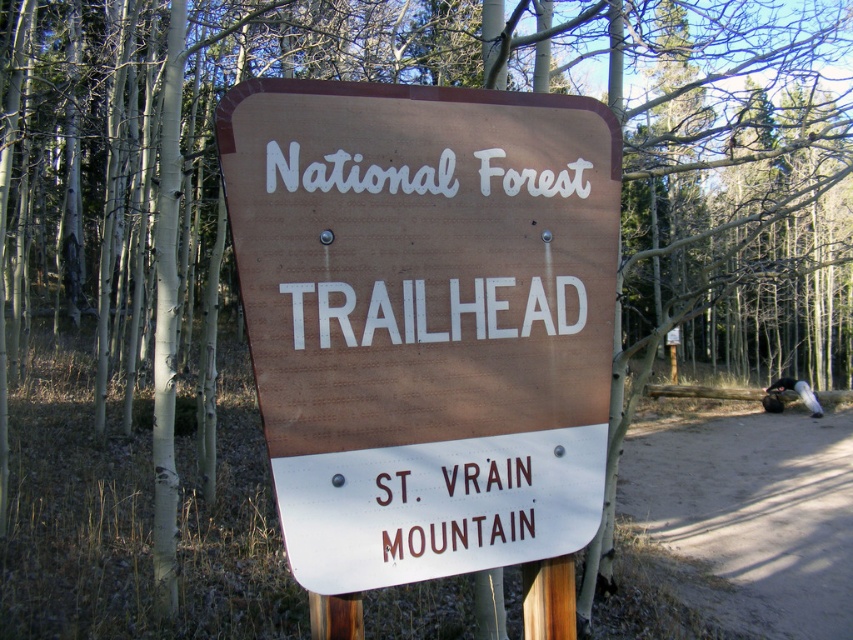
Question: Can you confirm if brown wood trailhead sign at center is bigger than dirt path at lower right?

Choices:
 (A) yes
 (B) no

Answer: (B)

Question: Considering the real-world distances, which object is closest to the dirt path at lower right?

Choices:
 (A) brown wood trailhead sign at center
 (B) white painted wood at center
 (C) brown/material sign at lower center

Answer: (A)

Question: Which of the following is the closest to the observer?

Choices:
 (A) (496, 337)
 (B) (780, 477)
 (C) (462, 525)

Answer: (C)

Question: Which point appears closest to the camera in this image?

Choices:
 (A) (535, 301)
 (B) (844, 451)
 (C) (402, 266)

Answer: (C)

Question: Is brown wood trailhead sign at center to the left of dirt path at lower right from the viewer's perspective?

Choices:
 (A) yes
 (B) no

Answer: (A)

Question: Is brown wood trailhead sign at center wider than dirt path at lower right?

Choices:
 (A) no
 (B) yes

Answer: (A)